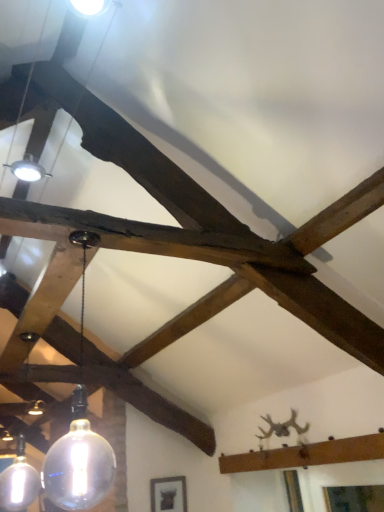
Question: From a real-world perspective, is matte black frame at lower center above or below transparent glass bulb at center, the 2th lamp from the back?

Choices:
 (A) above
 (B) below

Answer: (B)

Question: Is matte black frame at lower center taller or shorter than transparent glass bulb at center, the first lamp in the front-to-back sequence?

Choices:
 (A) tall
 (B) short

Answer: (B)

Question: Based on their relative distances, which object is nearer to the matte glass globe at lower left, positioned as the second lamp in front-to-back order?

Choices:
 (A) transparent glass bulb at center, the first lamp in the front-to-back sequence
 (B) matte black frame at lower center

Answer: (A)

Question: Estimate the real-world distances between objects in this image. Which object is farther from the matte black frame at lower center?

Choices:
 (A) transparent glass bulb at center, positioned as the first lamp in right-to-left order
 (B) matte glass globe at lower left, positioned as the second lamp in front-to-back order

Answer: (A)